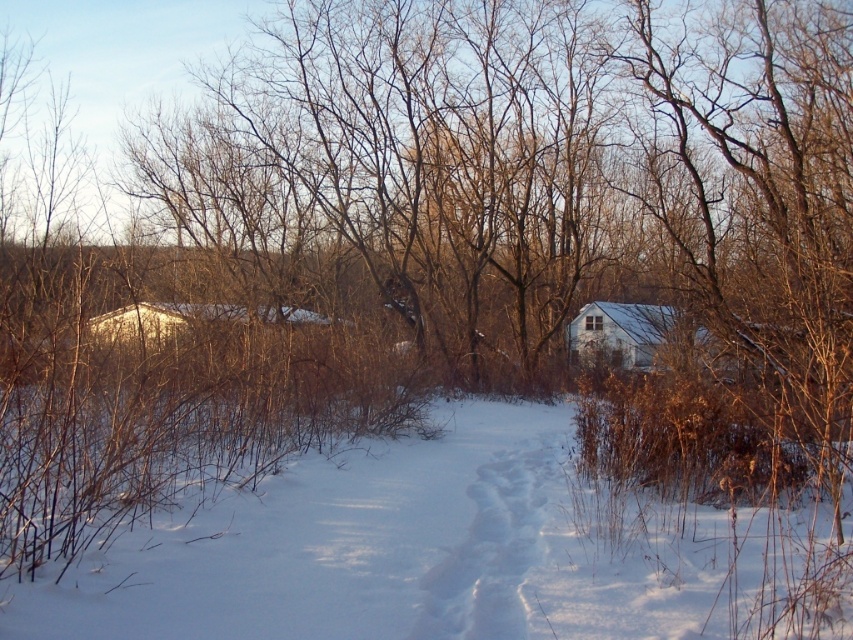
The image size is (853, 640). What do you see at coordinates (451, 554) in the screenshot?
I see `white powdery snow at center` at bounding box center [451, 554].

Which is behind, point (537, 490) or point (569, 346)?

The point (569, 346) is behind.

You are a GUI agent. You are given a task and a screenshot of the screen. Output one action in this format:
    pyautogui.click(x=<x>, y=<y>)
    Task: Click on the white powdery snow at center
    
    Given the screenshot: What is the action you would take?
    pyautogui.click(x=451, y=554)